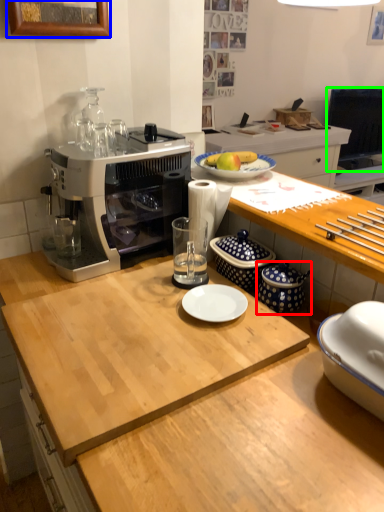
Question: Which object is positioned farthest from appliance (highlighted by a red box)? Select from picture frame (highlighted by a blue box) and television (highlighted by a green box).

Choices:
 (A) picture frame
 (B) television

Answer: (B)